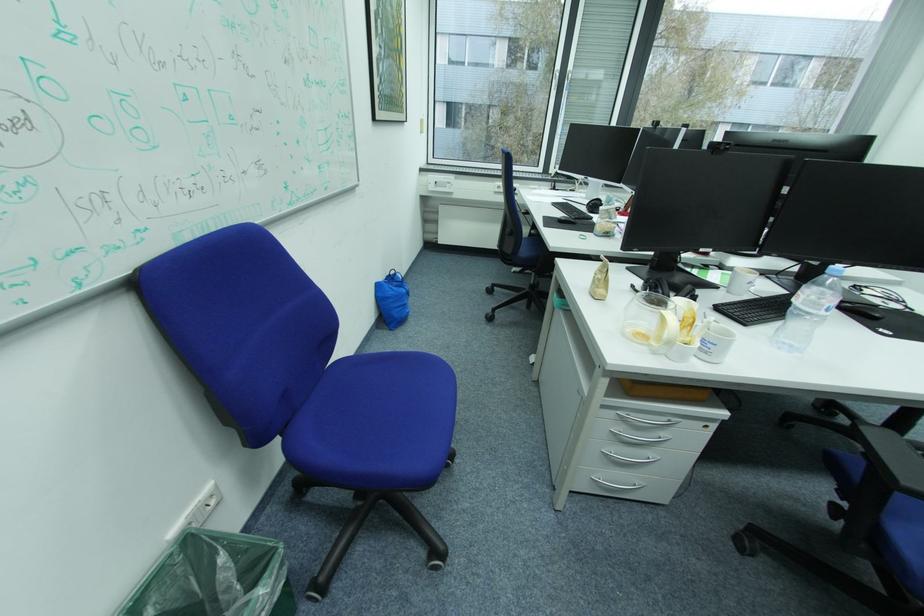
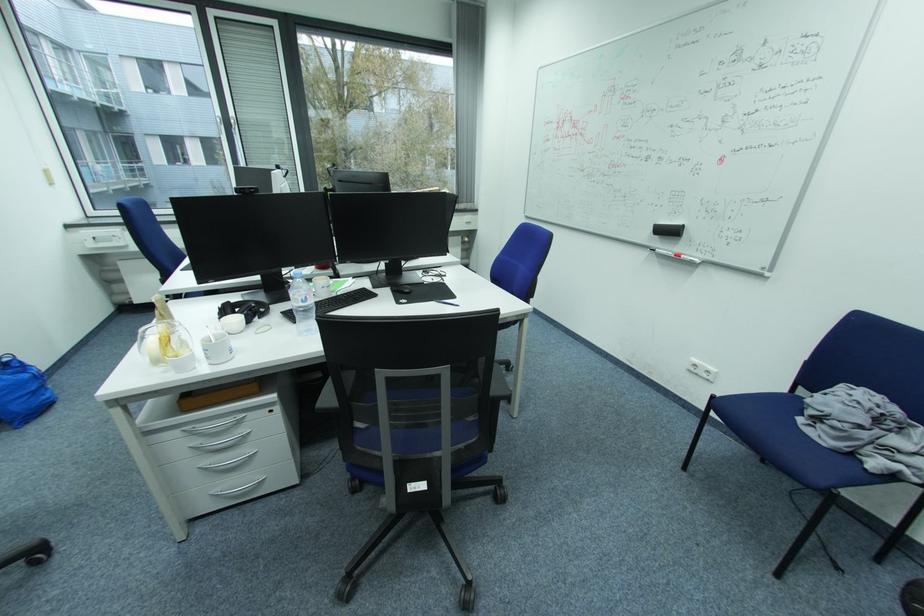
Locate, in the second image, the point that corresponds to point 400,293 in the first image.

(9, 385)